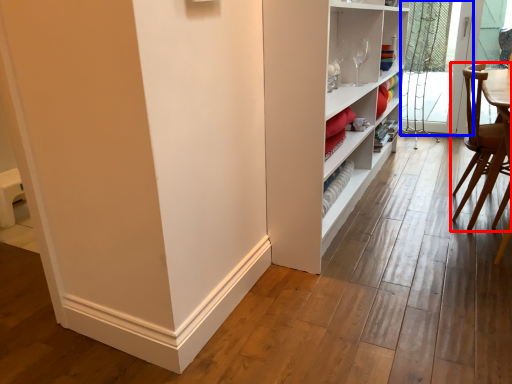
Question: Which object is closer to the camera taking this photo, chair (highlighted by a red box) or screen door (highlighted by a blue box)?

Choices:
 (A) chair
 (B) screen door

Answer: (A)